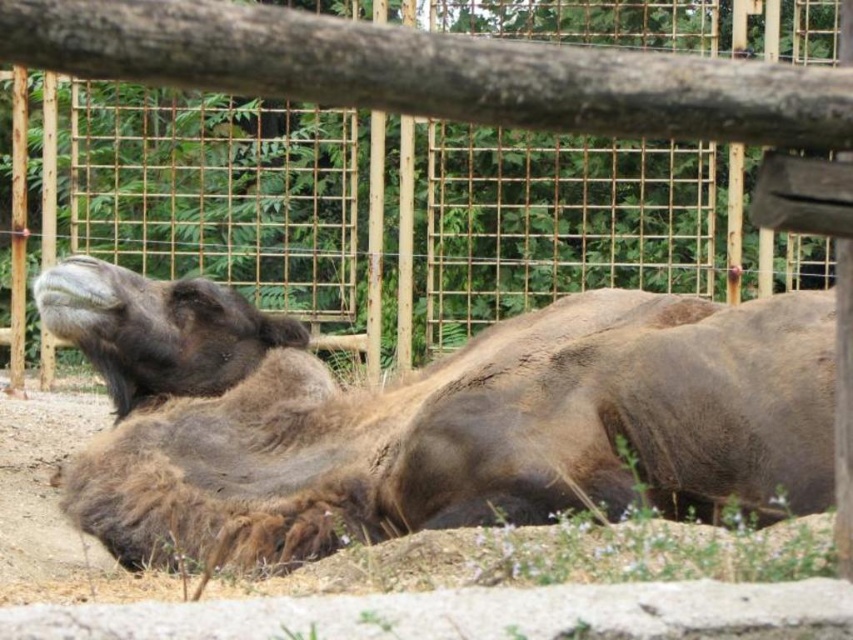
In the scene shown: Between brown fuzzy camel at center and wooden fence at upper center, which one appears on the left side from the viewer's perspective?

From the viewer's perspective, brown fuzzy camel at center appears more on the left side.

Does brown fuzzy camel at center lie in front of wooden fence at upper center?

No.

The height and width of the screenshot is (640, 853). What do you see at coordinates (433, 419) in the screenshot? I see `brown fuzzy camel at center` at bounding box center [433, 419].

Locate an element on the screen. brown fuzzy camel at center is located at coordinates (433, 419).